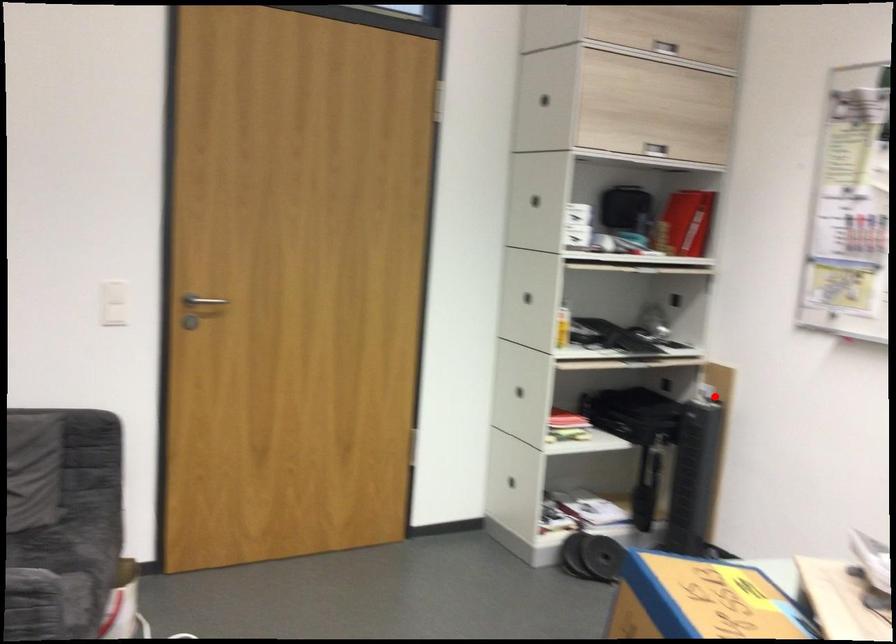
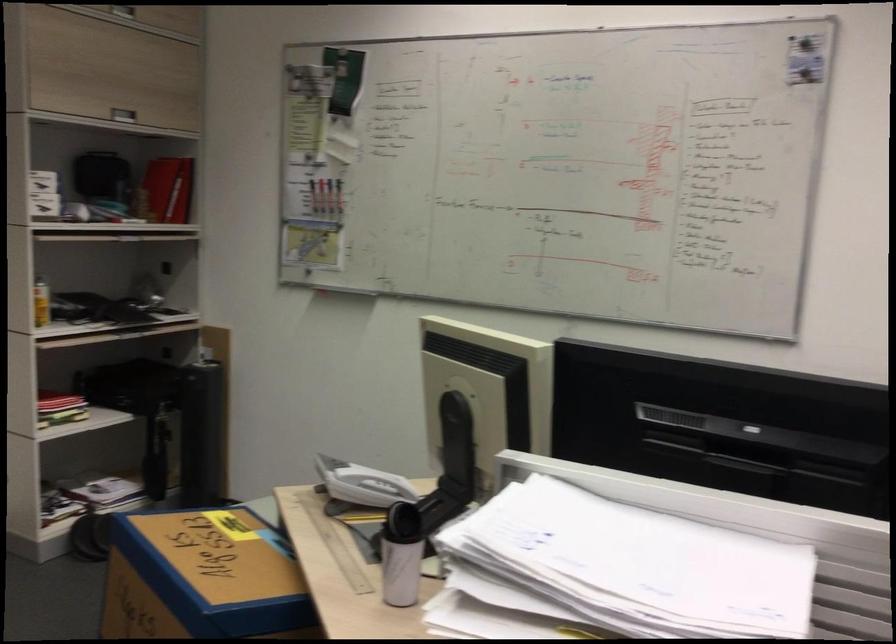
Find the pixel in the second image that matches the highlighted location in the first image.

(213, 359)